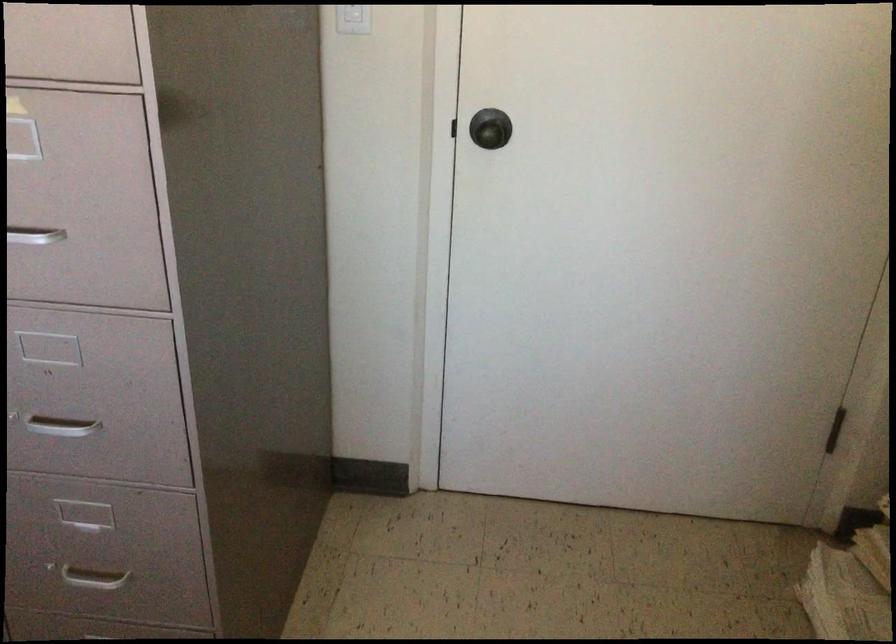
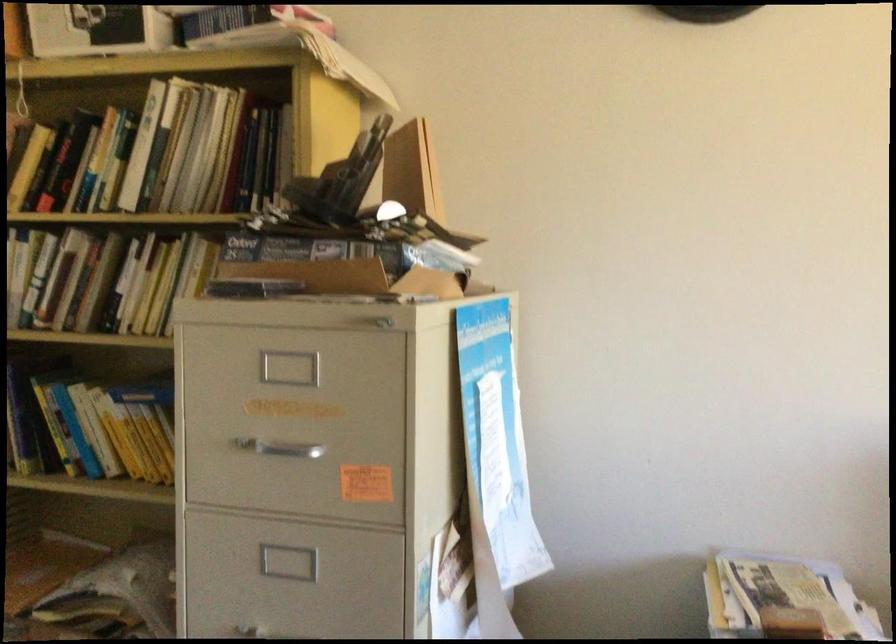
Question: The camera is either moving clockwise (left) or counter-clockwise (right) around the object. The first image is from the beginning of the video and the second image is from the end. Is the camera moving left or right when shooting the video?

Choices:
 (A) Left
 (B) Right

Answer: (A)